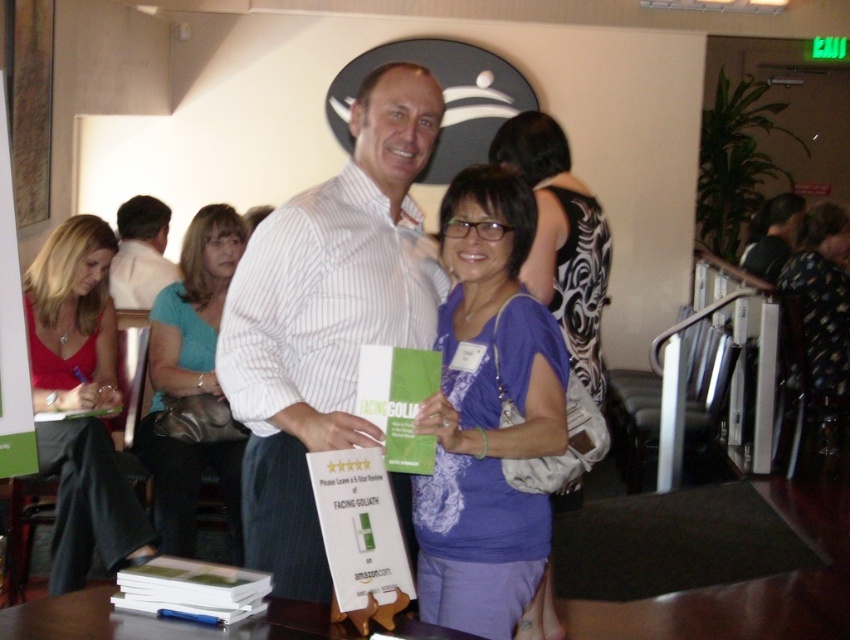
You are a photographer at the event and need to capture a clear shot of both the teal fabric purse at center and the dark gray shirt at center. Which object should you focus on first to ensure both are in focus?

You should focus on the teal fabric purse at center first since it is closer to the viewer than the dark gray shirt at center. By focusing on the closer object, the farther one will also be in focus due to the depth of field.